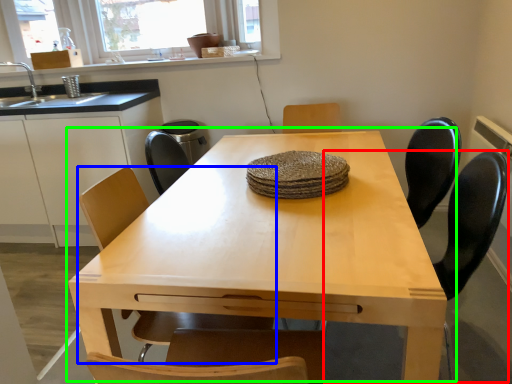
Question: Estimate the real-world distances between objects in this image. Which object is farther from swivel chair (highlighted by a red box), chair (highlighted by a blue box) or table (highlighted by a green box)?

Choices:
 (A) chair
 (B) table

Answer: (A)